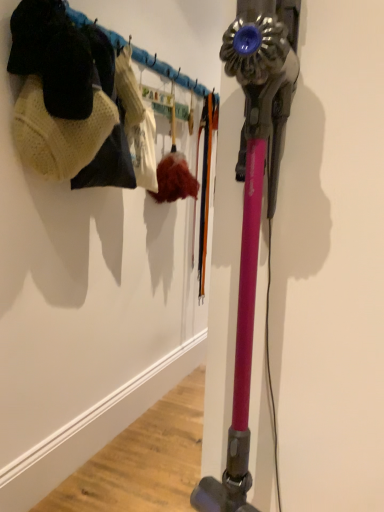
Question: Is knitted wool hat at upper left inside the boundaries of pink metallic vacuum at right, or outside?

Choices:
 (A) inside
 (B) outside

Answer: (B)

Question: From the image's perspective, is knitted wool hat at upper left above or below pink metallic vacuum at right?

Choices:
 (A) above
 (B) below

Answer: (A)

Question: Considering the positions of knitted wool hat at upper left and pink metallic vacuum at right in the image, is knitted wool hat at upper left taller or shorter than pink metallic vacuum at right?

Choices:
 (A) tall
 (B) short

Answer: (B)

Question: In terms of size, does pink metallic vacuum at right appear bigger or smaller than knitted wool hat at upper left?

Choices:
 (A) small
 (B) big

Answer: (B)

Question: Is pink metallic vacuum at right wider or thinner than knitted wool hat at upper left?

Choices:
 (A) thin
 (B) wide

Answer: (A)

Question: From the image's perspective, is pink metallic vacuum at right above or below knitted wool hat at upper left?

Choices:
 (A) below
 (B) above

Answer: (A)

Question: In the image, is pink metallic vacuum at right on the left side or the right side of knitted wool hat at upper left?

Choices:
 (A) right
 (B) left

Answer: (A)